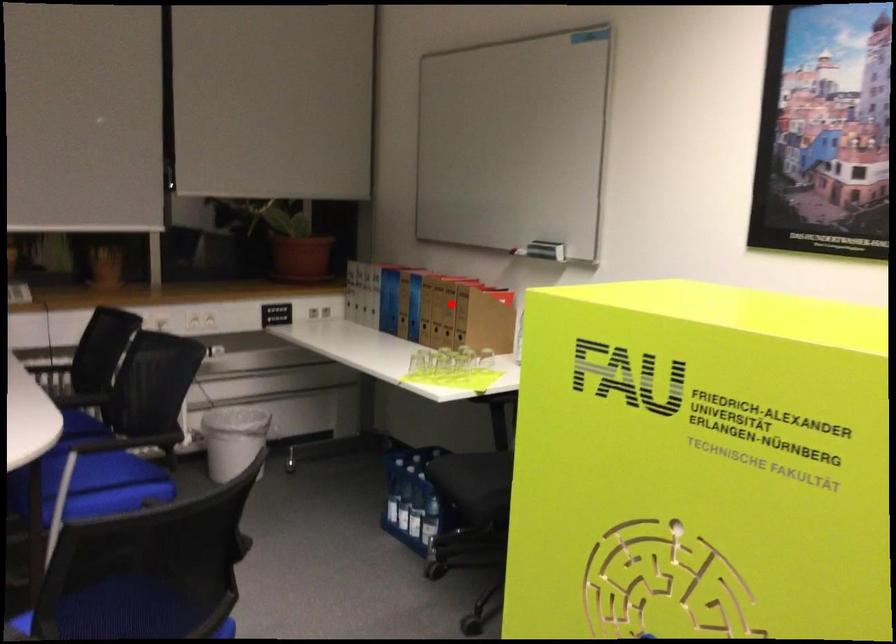
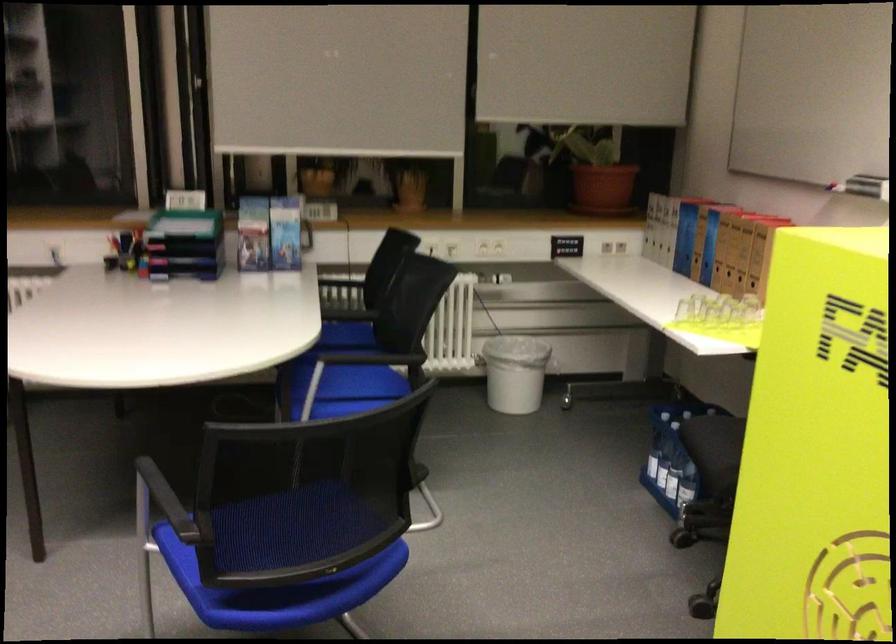
Locate, in the second image, the point that corresponds to the highlighted location in the first image.

(746, 243)